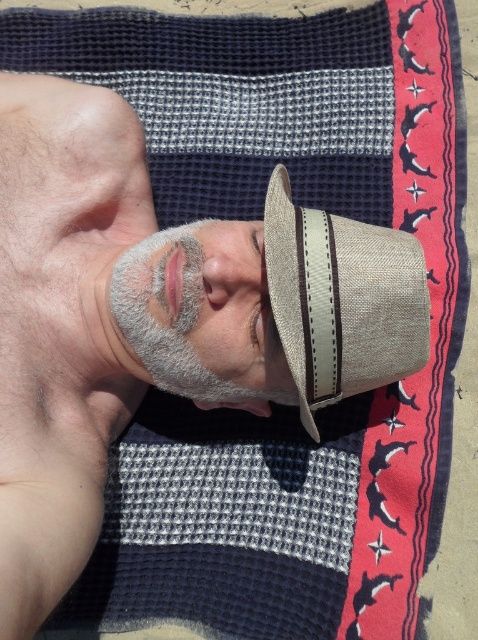
Question: Does beige straw hat at center appear over gray fabric face mask at center?

Choices:
 (A) no
 (B) yes

Answer: (B)

Question: Is beige straw hat at center further to camera compared to gray fabric face mask at center?

Choices:
 (A) yes
 (B) no

Answer: (B)

Question: Does beige straw hat at center appear on the left side of gray fabric face mask at center?

Choices:
 (A) yes
 (B) no

Answer: (B)

Question: Which point appears farthest from the camera in this image?

Choices:
 (A) (212, 400)
 (B) (382, 371)

Answer: (A)